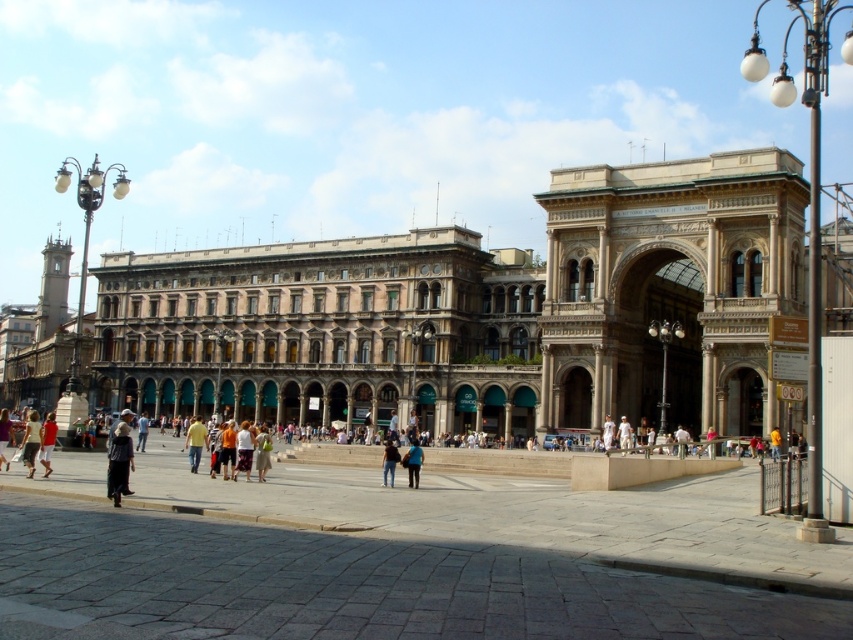
You are a photographer standing in the urban square. You want to take a photo of the white cotton dress at center without the brown stone building at center blocking the view. Is this possible?

The white cotton dress at center is behind the brown stone building at center, so it would be blocked from view by the building. You cannot take a photo of the white cotton dress at center without the brown stone building at center blocking the view.

You are a photographer standing in the square and want to take a photo of both the yellow cotton shirt at center and the yellow fabric person at center. Which object should you focus on first to ensure both are in frame?

The yellow cotton shirt at center is much taller than the yellow fabric person at center, so you should focus on the taller object first to ensure both are in frame.